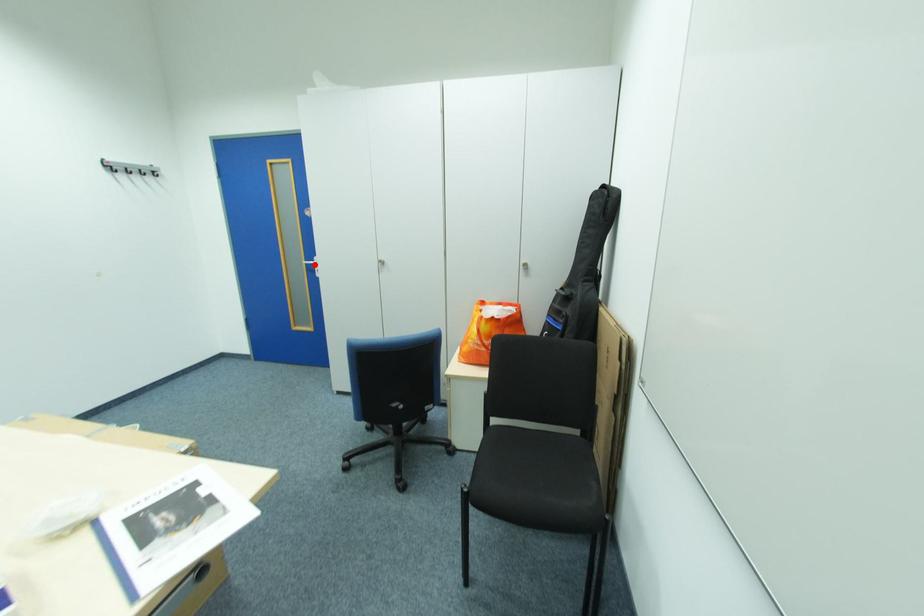
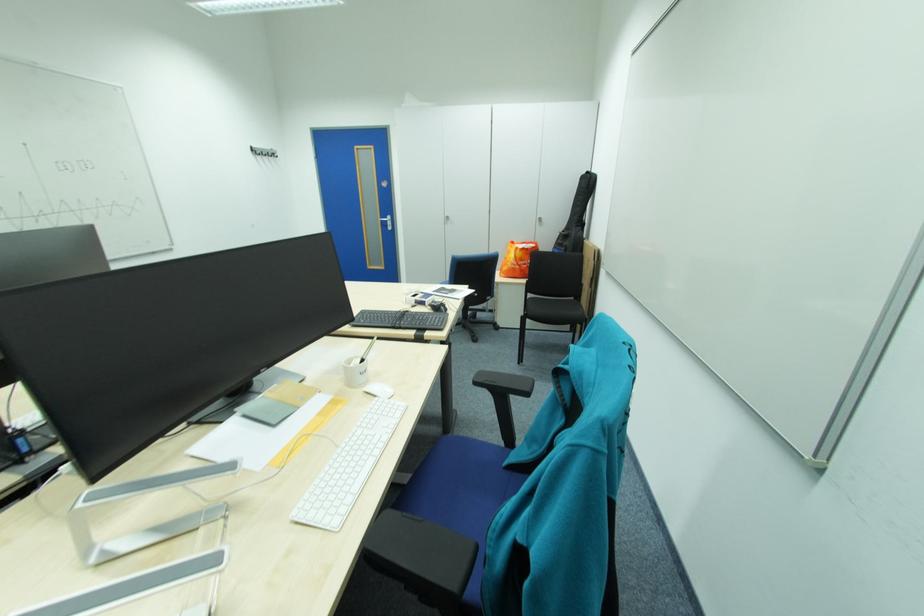
Question: I am providing you with two images of the same scene from different viewpoints. A red point is shown in image1. For the corresponding object point in image2, is it positioned nearer or farther from the camera?

Choices:
 (A) Nearer
 (B) Farther

Answer: (A)